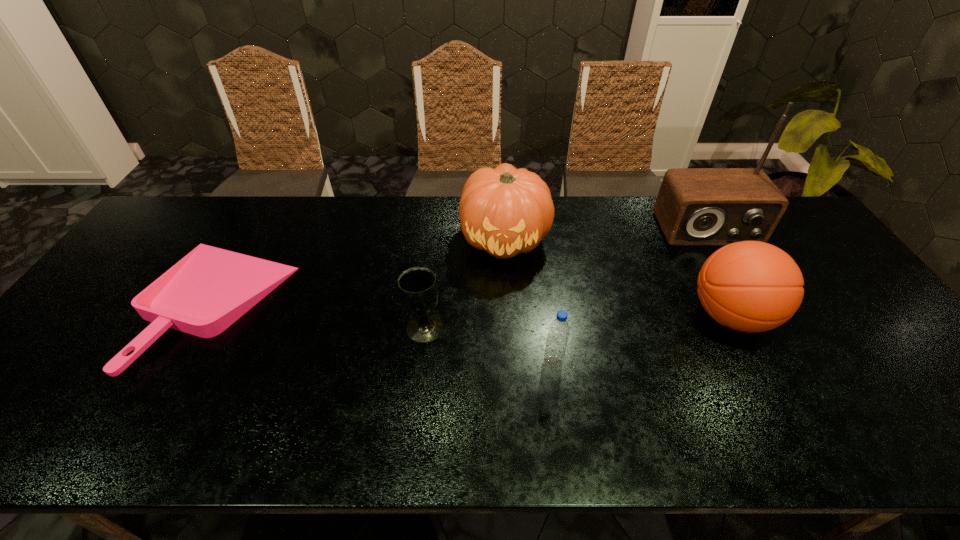
Where is `vacant area situated 0.170m on the left of the water bottle`? vacant area situated 0.170m on the left of the water bottle is located at coordinates (473, 362).

You are a GUI agent. You are given a task and a screenshot of the screen. Output one action in this format:
    pyautogui.click(x=<x>, y=<y>)
    Task: Click on the free space located 0.400m on the left of the chalice
    The height and width of the screenshot is (540, 960).
    Given the screenshot: What is the action you would take?
    pyautogui.click(x=251, y=327)

I want to click on free space located 0.140m on the handle side of the leftmost object, so pos(96,304).

You are a GUI agent. You are given a task and a screenshot of the screen. Output one action in this format:
    pyautogui.click(x=<x>, y=<y>)
    Task: Click on the free location located 0.150m on the handle side of the leftmost object
    
    Given the screenshot: What is the action you would take?
    pyautogui.click(x=92, y=304)

Where is `vacant space located 0.090m on the handle side of the leftmost object`? This screenshot has width=960, height=540. vacant space located 0.090m on the handle side of the leftmost object is located at coordinates (114, 304).

Identify the location of radio receiver present at the far edge. (695, 206).

The width and height of the screenshot is (960, 540). In order to click on pumpkin that is at the far edge in this screenshot , I will do `click(505, 211)`.

The width and height of the screenshot is (960, 540). I want to click on object present at the left edge, so click(x=210, y=288).

At what (x,y) coordinates should I click in order to perform the action: click on vacant space at the far edge of the desktop. Please return your answer as a coordinate pair (x, y). Image resolution: width=960 pixels, height=540 pixels. Looking at the image, I should click on (316, 216).

This screenshot has height=540, width=960. In the image, there is a desktop. Identify the location of vacant space at the near edge. (635, 414).